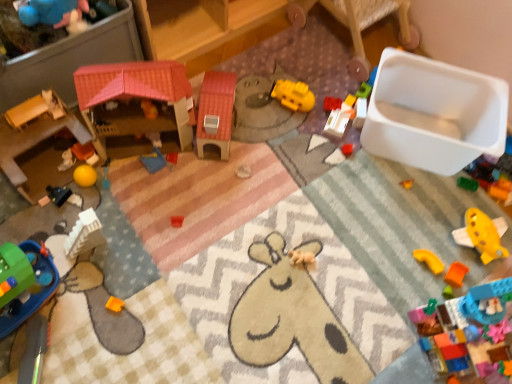
Locate an element on the screen. This screenshot has width=512, height=384. vacant space in between yellow matte plastic arch at lower right, acting as the 4th toy starting from the right, and white plastic container at center, acting as the 10th toy starting from the left is located at coordinates (379, 194).